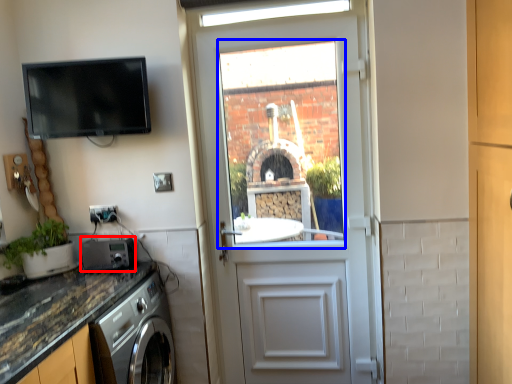
Question: Which of the following is the farthest to the observer, appliance (highlighted by a red box) or window (highlighted by a blue box)?

Choices:
 (A) appliance
 (B) window

Answer: (B)